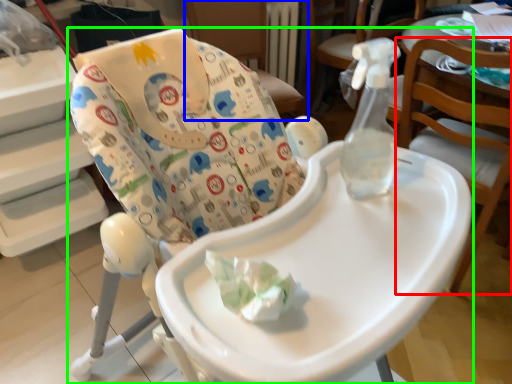
Question: Which is farther away from chair (highlighted by a red box)? chair (highlighted by a blue box) or chair (highlighted by a green box)?

Choices:
 (A) chair
 (B) chair

Answer: (A)